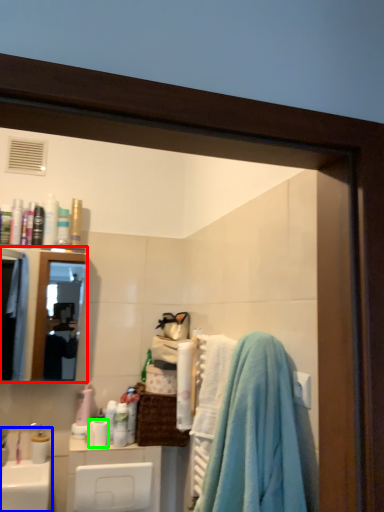
Question: Considering the real-world distances, which object is closest to mirror (highlighted by a red box)? sink (highlighted by a blue box) or toilet paper (highlighted by a green box).

Choices:
 (A) sink
 (B) toilet paper

Answer: (A)